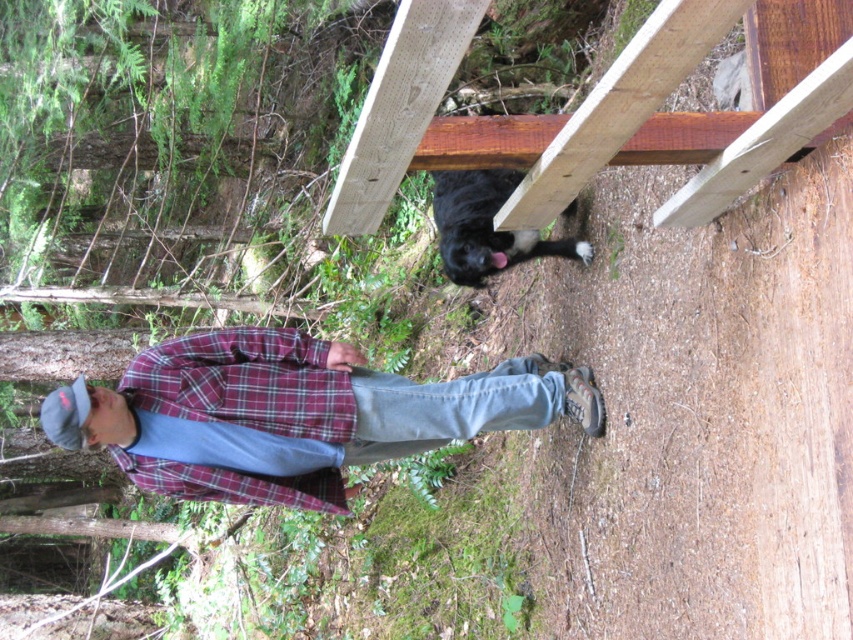
Question: Does plaid flannel shirt at center have a greater width compared to plaid fabric at center?

Choices:
 (A) no
 (B) yes

Answer: (B)

Question: Among these points, which one is nearest to the camera?

Choices:
 (A) (317, 484)
 (B) (119, 440)

Answer: (B)

Question: Can you confirm if plaid flannel shirt at center is positioned to the left of plaid fabric at center?

Choices:
 (A) no
 (B) yes

Answer: (A)

Question: Does plaid flannel shirt at center come behind plaid fabric at center?

Choices:
 (A) no
 (B) yes

Answer: (A)